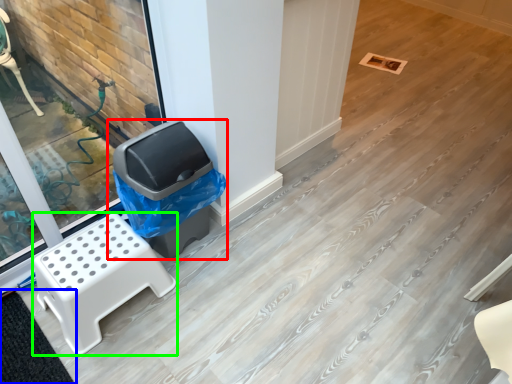
Question: Which is nearer to the waste container (highlighted by a red box)? mat (highlighted by a blue box) or furniture (highlighted by a green box).

Choices:
 (A) mat
 (B) furniture

Answer: (B)